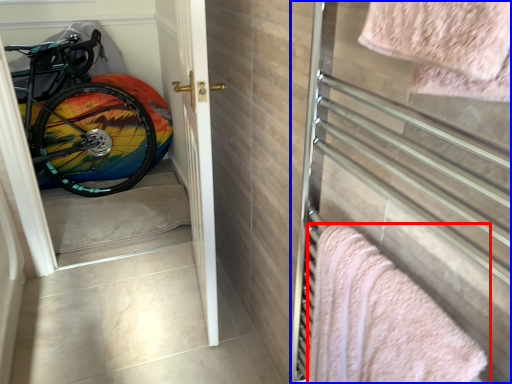
Question: Among these objects, which one is nearest to the camera, towel (highlighted by a red box) or screen door (highlighted by a blue box)?

Choices:
 (A) towel
 (B) screen door

Answer: (B)